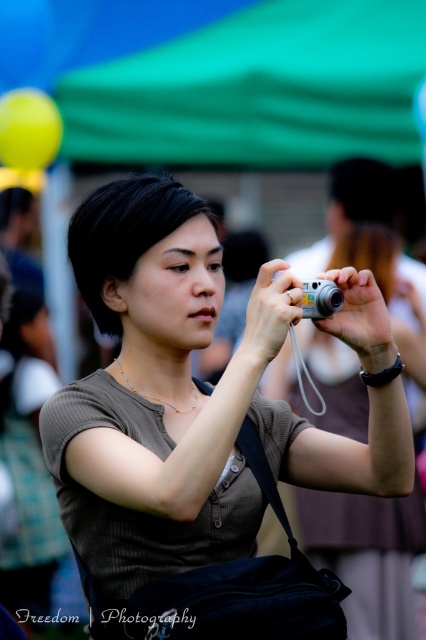
Can you confirm if matte brown shirt at center is positioned to the left of green fabric canopy at upper center?

Correct, you'll find matte brown shirt at center to the left of green fabric canopy at upper center.

Between matte brown shirt at center and green fabric canopy at upper center, which one is positioned lower?

matte brown shirt at center

Identify the location of matte brown shirt at center. Image resolution: width=426 pixels, height=640 pixels. (196, 394).

At what (x,y) coordinates should I click in order to perform the action: click on matte brown shirt at center. Please return your answer as a coordinate pair (x, y). Looking at the image, I should click on (196, 394).

Between matte brown shirt at center and silver metallic camera at center, which one is positioned lower?

Positioned lower is matte brown shirt at center.

Image resolution: width=426 pixels, height=640 pixels. Find the location of `matte brown shirt at center`. matte brown shirt at center is located at coordinates (196, 394).

Is point (178, 426) positioned after point (333, 282)?

Yes, it is behind point (333, 282).

Identify the location of matte brown shirt at center. (196, 394).

Is green fabric canopy at upper center further to camera compared to silver metallic camera at center?

Yes.

Is point (301, 13) farther from viewer compared to point (314, 285)?

Yes, point (301, 13) is farther from viewer.

Identify the location of green fabric canopy at upper center. This screenshot has height=640, width=426. (258, 90).

Identify the location of green fabric canopy at upper center. Image resolution: width=426 pixels, height=640 pixels. (258, 90).